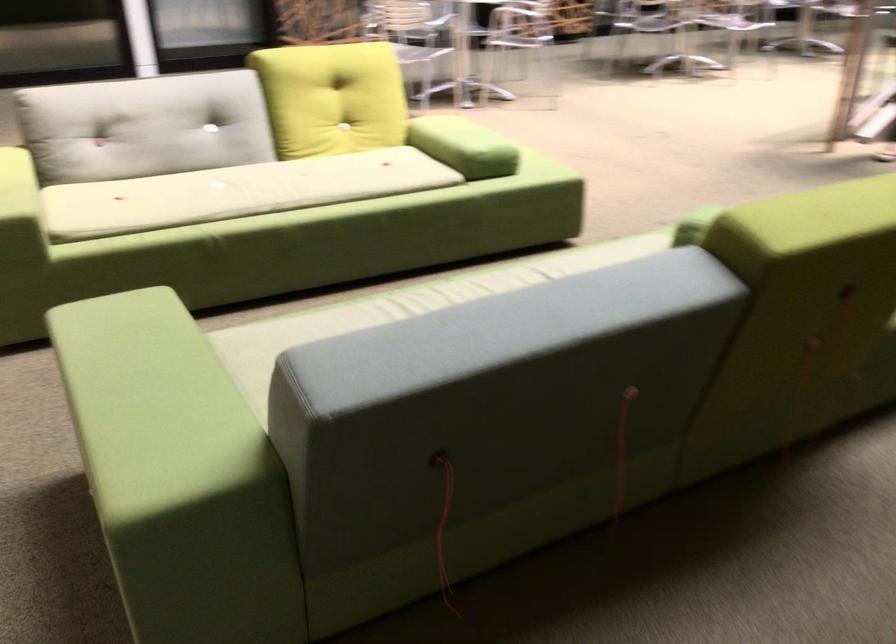
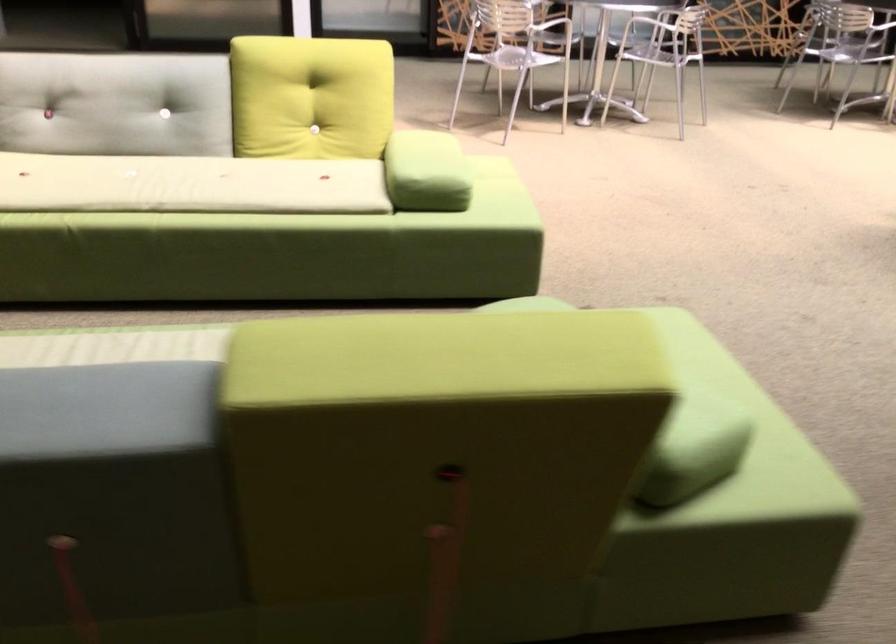
What movement of the cameraman would produce the second image?

The cameraman walked toward right, forward.